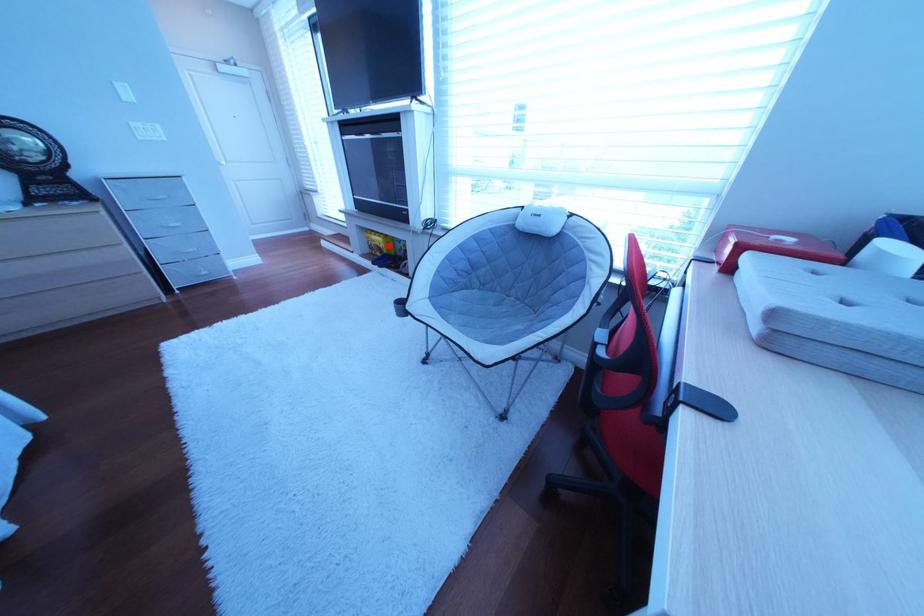
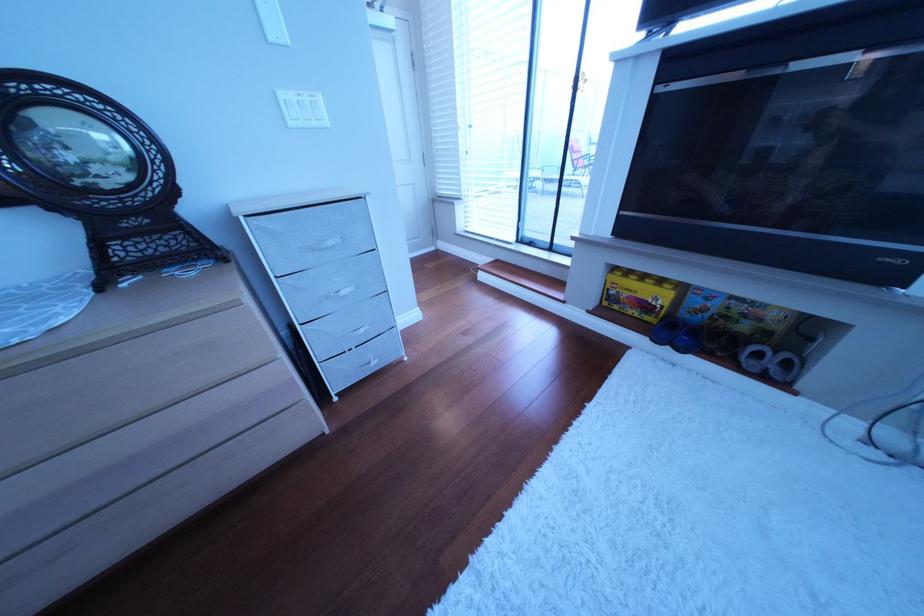
The point at the highlighted location is marked in the first image. Where is the corresponding point in the second image?

(640, 296)